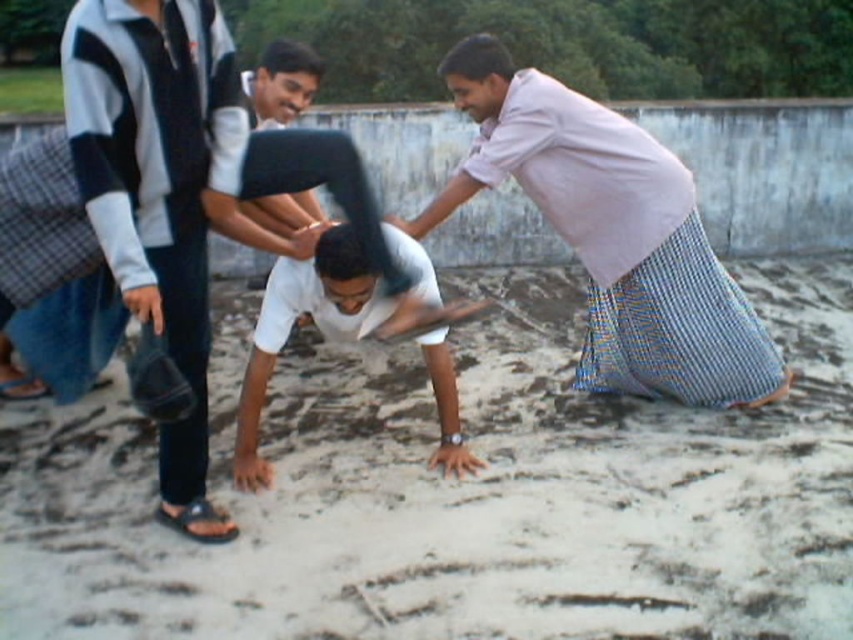
Question: Among these points, which one is nearest to the camera?

Choices:
 (A) (407, 257)
 (B) (267, 86)
 (C) (126, 509)
 (D) (701, 381)

Answer: (C)

Question: Which object is farther from the camera taking this photo?

Choices:
 (A) white matte shirt at center
 (B) blue woven cloth at right

Answer: (B)

Question: Is white sandy ground at center wider than white matte shirt at center?

Choices:
 (A) no
 (B) yes

Answer: (B)

Question: Considering the real-world distances, which object is closest to the blue woven cloth at right?

Choices:
 (A) white sandy ground at center
 (B) white matte shirt at center
 (C) white cotton shirt at upper center

Answer: (A)

Question: Does white matte shirt at center have a larger size compared to white cotton shirt at upper center?

Choices:
 (A) no
 (B) yes

Answer: (B)

Question: Is white sandy ground at center to the left of light pink woven cloth at upper right from the viewer's perspective?

Choices:
 (A) yes
 (B) no

Answer: (A)